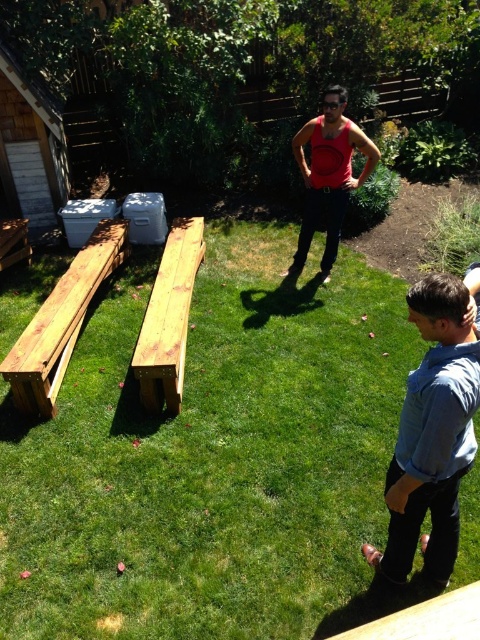
Question: Which object is positioned farthest from the matte red tank top at center?

Choices:
 (A) natural wood bench at center
 (B) green grass at center
 (C) natural wood bench at left
 (D) natural wood bench at lower left

Answer: (D)

Question: Is blue denim shirt at lower right positioned at the back of matte red tank top at center?

Choices:
 (A) no
 (B) yes

Answer: (A)

Question: Where is matte red tank top at center located in relation to natural wood bench at lower left in the image?

Choices:
 (A) above
 (B) below

Answer: (A)

Question: Is blue denim shirt at lower right closer to camera compared to natural wood bench at lower left?

Choices:
 (A) yes
 (B) no

Answer: (A)

Question: Which object is the closest to the blue denim shirt at lower right?

Choices:
 (A) natural wood bench at left
 (B) natural wood bench at lower left
 (C) matte red tank top at center

Answer: (A)

Question: Estimate the real-world distances between objects in this image. Which object is farther from the matte red tank top at center?

Choices:
 (A) natural wood bench at left
 (B) green grass at center

Answer: (A)